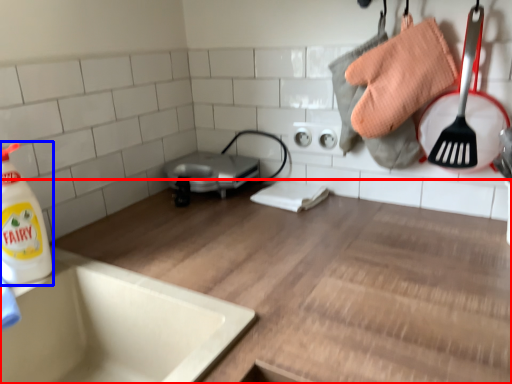
Question: Among these objects, which one is nearest to the camera, countertop (highlighted by a red box) or cleaning product (highlighted by a blue box)?

Choices:
 (A) countertop
 (B) cleaning product

Answer: (A)